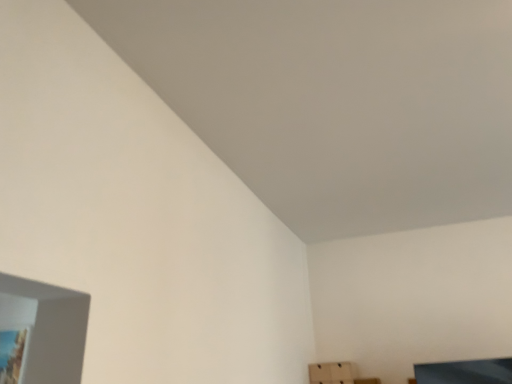
Locate an element on the screen. This screenshot has height=384, width=512. white cardboard box at lower right is located at coordinates (330, 373).

This screenshot has height=384, width=512. What do you see at coordinates (330, 373) in the screenshot? I see `white cardboard box at lower right` at bounding box center [330, 373].

Measure the distance between point (315,374) and camera.

Point (315,374) is 2.82 meters away from camera.

Image resolution: width=512 pixels, height=384 pixels. What are the coordinates of `white cardboard box at lower right` in the screenshot? It's located at (330, 373).